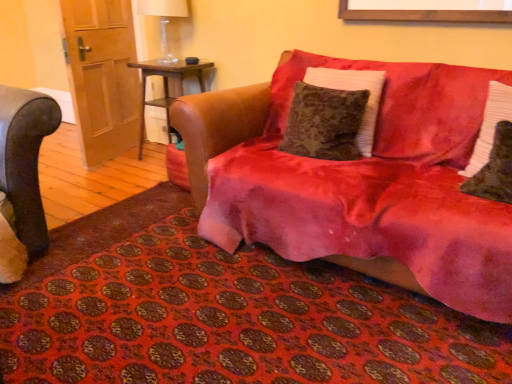
Question: Is velvet red mat at lower center taller or shorter than wooden door at left?

Choices:
 (A) tall
 (B) short

Answer: (B)

Question: Does point (335, 367) appear closer or farther from the camera than point (120, 54)?

Choices:
 (A) farther
 (B) closer

Answer: (B)

Question: Based on their relative distances, which object is nearer to the white textured pillow at right, positioned as the first pillow in right-to-left order?

Choices:
 (A) wooden side table at center
 (B) velvet red mat at lower center
 (C) velvet red couch at center
 (D) velvet brown pillow at center, placed as the third pillow when sorted from right to left
 (E) wooden door at left

Answer: (C)

Question: Which of these objects is positioned closest to the white textured pillow at right, which ranks as the third pillow in left-to-right order?

Choices:
 (A) wooden side table at center
 (B) velvet brown pillow at center, the 1th pillow when ordered from left to right
 (C) velvet red couch at center
 (D) velvet red mat at lower center
 (E) wooden door at left

Answer: (C)